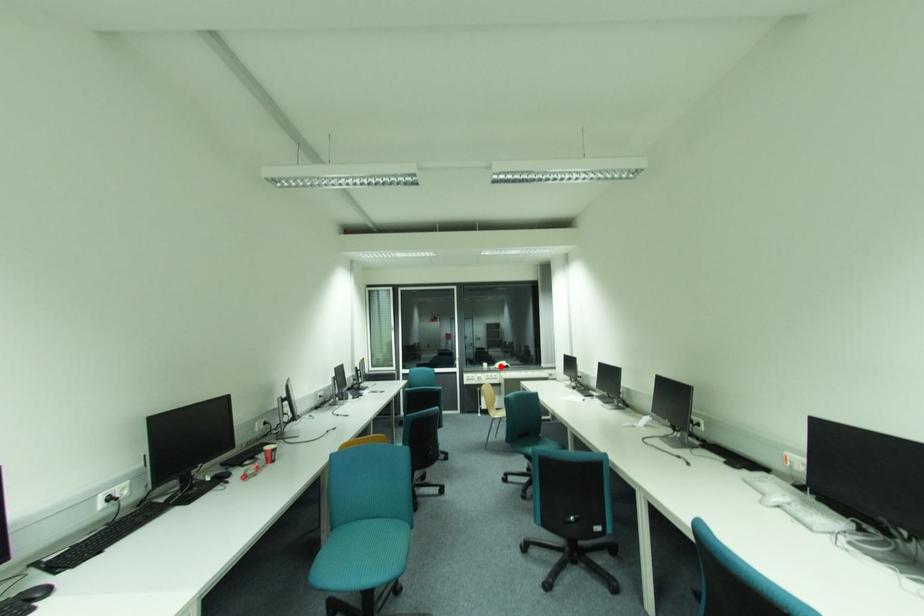
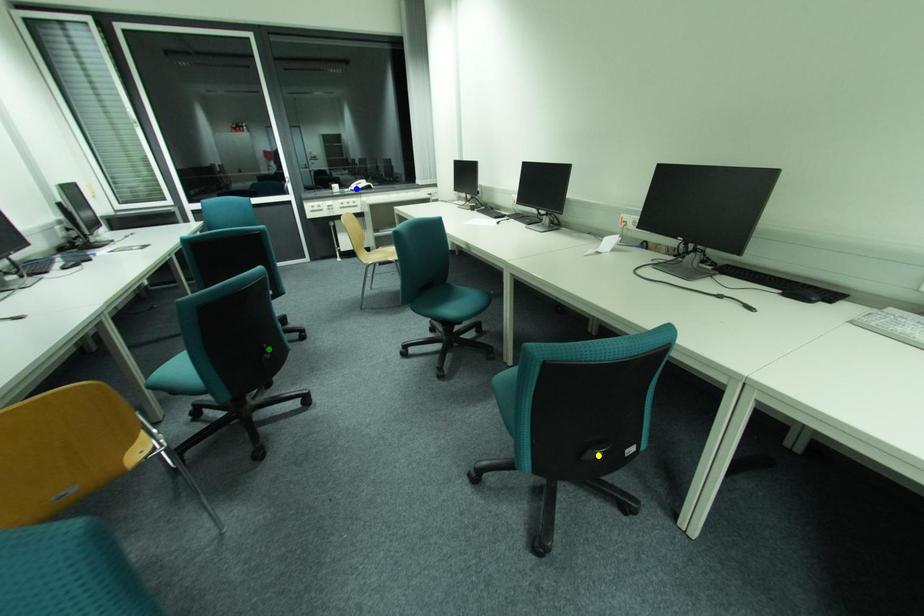
Question: I am providing you with two images of the same scene from different viewpoints. A red point is marked on the first image. You are given multiple points on the second image. In image 2, which mark is for the same physical point as the one in image 1?

Choices:
 (A) yellow point
 (B) green point
 (C) blue point

Answer: (C)